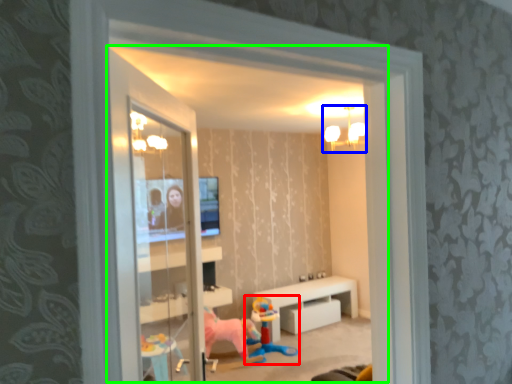
Question: Considering the real-world distances, which object is farthest from toy (highlighted by a red box)? light fixture (highlighted by a blue box) or window (highlighted by a green box)?

Choices:
 (A) light fixture
 (B) window

Answer: (A)